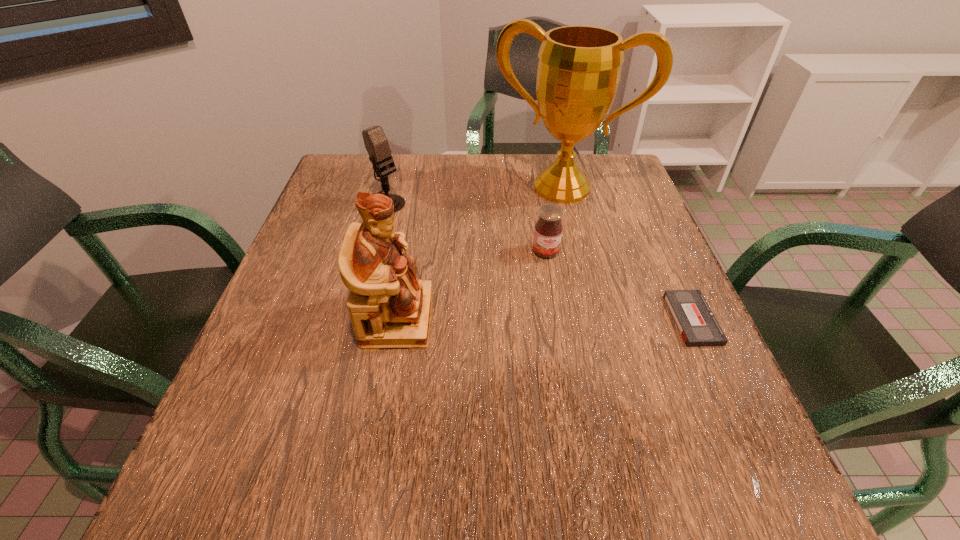
Locate an element on the screen. The width and height of the screenshot is (960, 540). empty space that is in between the microphone and the fourth tallest object is located at coordinates (464, 228).

Where is `vacant area between the microphone and the third farthest object`? The height and width of the screenshot is (540, 960). vacant area between the microphone and the third farthest object is located at coordinates (464, 228).

At what (x,y) coordinates should I click in order to perform the action: click on unoccupied position between the award and the third tallest object. Please return your answer as a coordinate pair (x, y). Looking at the image, I should click on (472, 195).

At what (x,y) coordinates should I click in order to perform the action: click on blank region between the videotape and the microphone. Please return your answer as a coordinate pair (x, y). Image resolution: width=960 pixels, height=540 pixels. Looking at the image, I should click on (538, 261).

You are a GUI agent. You are given a task and a screenshot of the screen. Output one action in this format:
    pyautogui.click(x=<x>, y=<y>)
    Task: Click on the free space between the third tallest object and the award
    This screenshot has height=540, width=960.
    Given the screenshot: What is the action you would take?
    pyautogui.click(x=472, y=195)

This screenshot has width=960, height=540. I want to click on free spot between the third tallest object and the shortest object, so click(x=538, y=261).

You are a GUI agent. You are given a task and a screenshot of the screen. Output one action in this format:
    pyautogui.click(x=<x>, y=<y>)
    Task: Click on the free spot between the award and the figurine
    The image size is (960, 540).
    Given the screenshot: What is the action you would take?
    pyautogui.click(x=480, y=253)

Locate which object is the second closest to the award. Please provide its 2D coordinates. Your answer should be formatted as a tuple, i.e. [(x, y)], where the tuple contains the x and y coordinates of a point satisfying the conditions above.

[(376, 143)]

Select which object appears as the closest to the award. Please provide its 2D coordinates. Your answer should be formatted as a tuple, i.e. [(x, y)], where the tuple contains the x and y coordinates of a point satisfying the conditions above.

[(548, 230)]